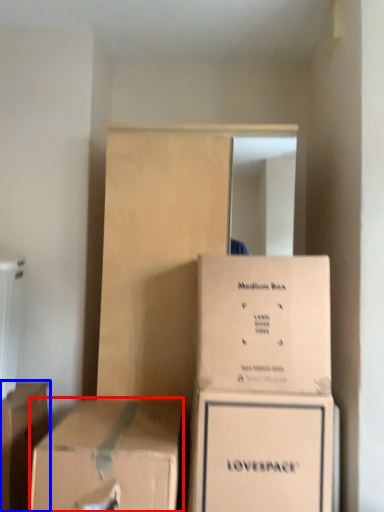
Question: Which of the following is the closest to the observer, box (highlighted by a red box) or box (highlighted by a blue box)?

Choices:
 (A) box
 (B) box

Answer: (A)